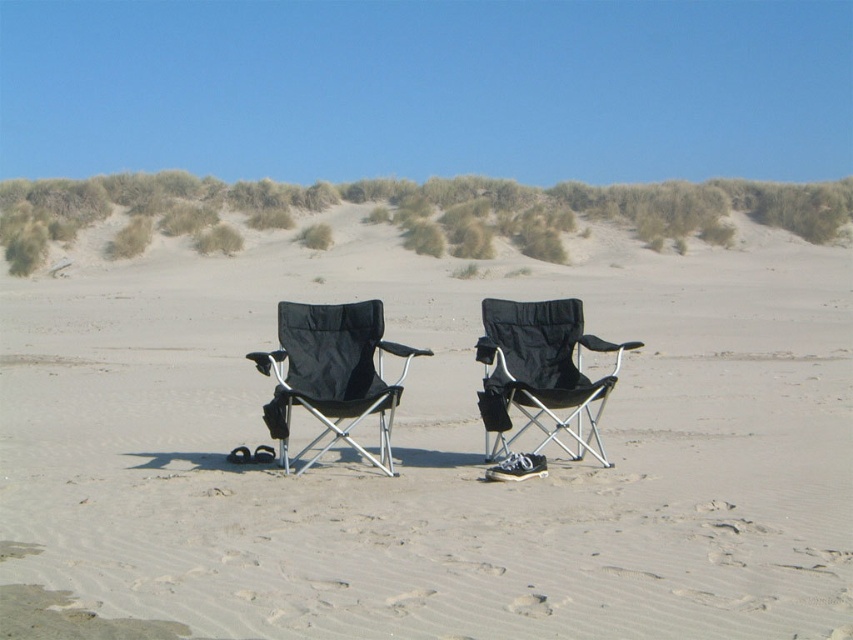
Question: Does green grassy dune at upper center have a greater width compared to black fabric chair at center?

Choices:
 (A) yes
 (B) no

Answer: (A)

Question: Which of these objects is positioned farthest from the black fabric chair at center?

Choices:
 (A) black fabric chairs at center
 (B) green grassy dune at upper center

Answer: (B)

Question: Estimate the real-world distances between objects in this image. Which object is closer to the black fabric chairs at center?

Choices:
 (A) green grassy dune at upper center
 (B) black fabric folding chair at center
 (C) black fabric chair at center

Answer: (A)

Question: Is black fabric chairs at center wider than black fabric folding chair at center?

Choices:
 (A) no
 (B) yes

Answer: (B)

Question: Which of these objects is positioned farthest from the green grassy dune at upper center?

Choices:
 (A) black fabric folding chair at center
 (B) black fabric chair at center
 (C) black fabric chairs at center

Answer: (A)

Question: Can you confirm if green grassy dune at upper center is wider than black fabric chair at center?

Choices:
 (A) yes
 (B) no

Answer: (A)